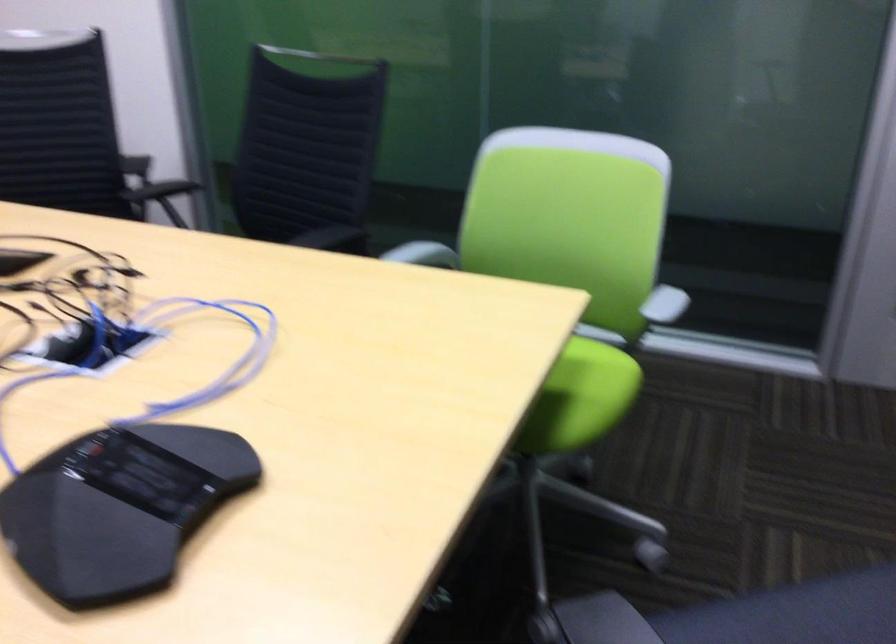
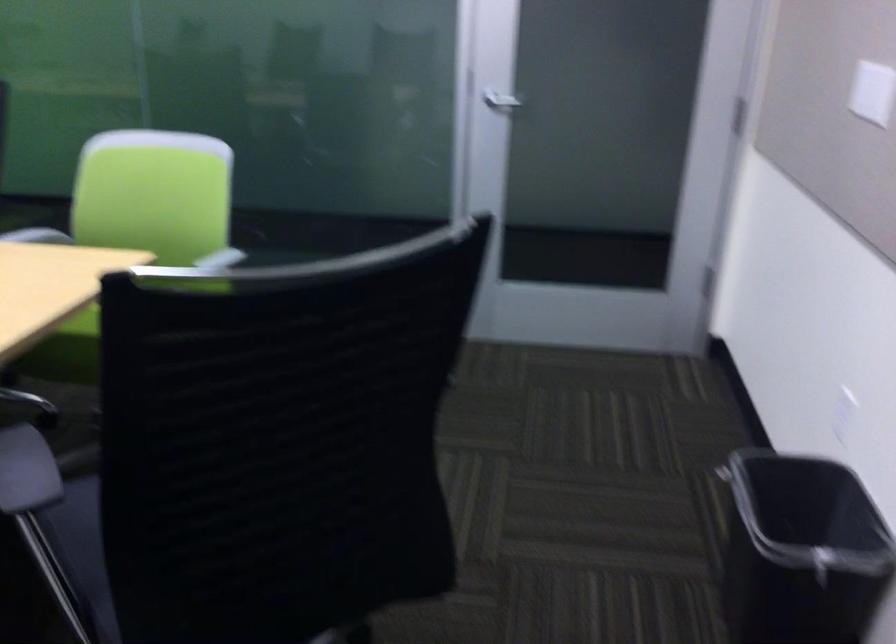
Question: The camera is either moving clockwise (left) or counter-clockwise (right) around the object. The first image is from the beginning of the video and the second image is from the end. Is the camera moving left or right when shooting the video?

Choices:
 (A) Left
 (B) Right

Answer: (A)